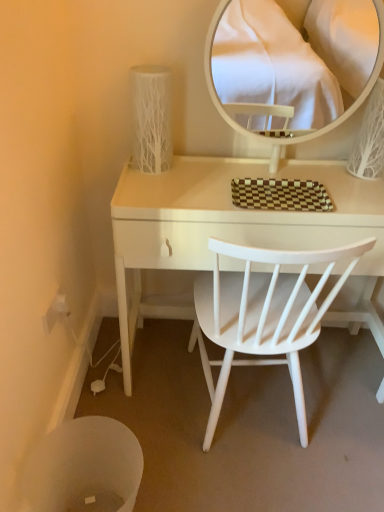
Question: Should I look upward or downward to see white plastic trash bin at lower left?

Choices:
 (A) down
 (B) up

Answer: (A)

Question: Does white plastic trash bin at lower left lie behind brown checkered tray at center?

Choices:
 (A) no
 (B) yes

Answer: (A)

Question: Does white plastic trash bin at lower left have a greater height compared to brown checkered tray at center?

Choices:
 (A) yes
 (B) no

Answer: (A)

Question: Is white plastic trash bin at lower left positioned before brown checkered tray at center?

Choices:
 (A) no
 (B) yes

Answer: (B)

Question: Can you confirm if white plastic trash bin at lower left is shorter than brown checkered tray at center?

Choices:
 (A) yes
 (B) no

Answer: (B)

Question: Can we say white plastic trash bin at lower left lies outside brown checkered tray at center?

Choices:
 (A) yes
 (B) no

Answer: (A)

Question: Considering the relative positions of white plastic trash bin at lower left and brown checkered tray at center in the image provided, is white plastic trash bin at lower left to the left of brown checkered tray at center from the viewer's perspective?

Choices:
 (A) no
 (B) yes

Answer: (B)

Question: From a real-world perspective, is white textured vase at upper left below brown checkered tray at center?

Choices:
 (A) no
 (B) yes

Answer: (A)

Question: Could you tell me if white textured vase at upper left is turned towards brown checkered tray at center?

Choices:
 (A) no
 (B) yes

Answer: (A)

Question: Considering the relative sizes of white textured vase at upper left and brown checkered tray at center in the image provided, is white textured vase at upper left thinner than brown checkered tray at center?

Choices:
 (A) yes
 (B) no

Answer: (A)

Question: Is white textured vase at upper left positioned far away from brown checkered tray at center?

Choices:
 (A) yes
 (B) no

Answer: (B)

Question: From a real-world perspective, is white textured vase at upper left on top of brown checkered tray at center?

Choices:
 (A) yes
 (B) no

Answer: (A)

Question: Is the surface of white textured vase at upper left in direct contact with brown checkered tray at center?

Choices:
 (A) yes
 (B) no

Answer: (B)

Question: Is white glossy mirror at upper center positioned far away from white plastic power outlet at lower left?

Choices:
 (A) yes
 (B) no

Answer: (A)